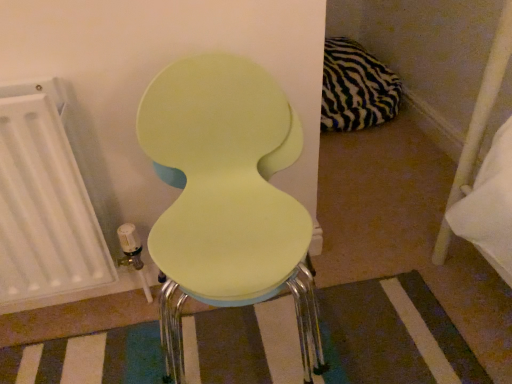
Question: Should I look upward or downward to see matte green chair at center?

Choices:
 (A) down
 (B) up

Answer: (A)

Question: Is white matte radiator at left at the left side of matte green chair at center?

Choices:
 (A) yes
 (B) no

Answer: (A)

Question: Is white matte radiator at left shorter than matte green chair at center?

Choices:
 (A) no
 (B) yes

Answer: (B)

Question: From the image's perspective, does white matte radiator at left appear lower than matte green chair at center?

Choices:
 (A) no
 (B) yes

Answer: (A)

Question: From the image's perspective, is white matte radiator at left located above matte green chair at center?

Choices:
 (A) yes
 (B) no

Answer: (A)

Question: Is white matte radiator at left at the right side of matte green chair at center?

Choices:
 (A) no
 (B) yes

Answer: (A)

Question: Can you confirm if white matte radiator at left is smaller than matte green chair at center?

Choices:
 (A) yes
 (B) no

Answer: (A)

Question: From a real-world perspective, is matte green chair at center over matte yellow stool at center?

Choices:
 (A) no
 (B) yes

Answer: (B)

Question: Can you confirm if matte green chair at center is wider than matte yellow stool at center?

Choices:
 (A) no
 (B) yes

Answer: (B)

Question: Is matte green chair at center facing towards matte yellow stool at center?

Choices:
 (A) yes
 (B) no

Answer: (B)

Question: Is matte green chair at center taller than matte yellow stool at center?

Choices:
 (A) yes
 (B) no

Answer: (A)

Question: Is matte green chair at center positioned behind matte yellow stool at center?

Choices:
 (A) no
 (B) yes

Answer: (A)

Question: Is matte green chair at center shorter than matte yellow stool at center?

Choices:
 (A) yes
 (B) no

Answer: (B)

Question: Is matte green chair at center closer to camera compared to zebra-patterned fabric pillow at upper right?

Choices:
 (A) yes
 (B) no

Answer: (A)